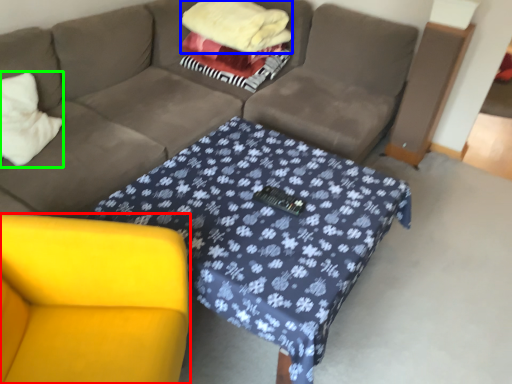
Question: Which object is positioned closest to armchair (highlighted by a red box)? Select from blanket (highlighted by a blue box) and throw pillow (highlighted by a green box).

Choices:
 (A) blanket
 (B) throw pillow

Answer: (B)